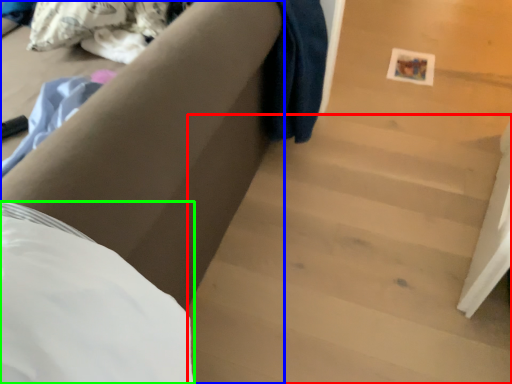
Question: Which object is positioned farthest from stairwell (highlighted by a red box)? Select from furniture (highlighted by a blue box) and sheet (highlighted by a green box).

Choices:
 (A) furniture
 (B) sheet

Answer: (B)